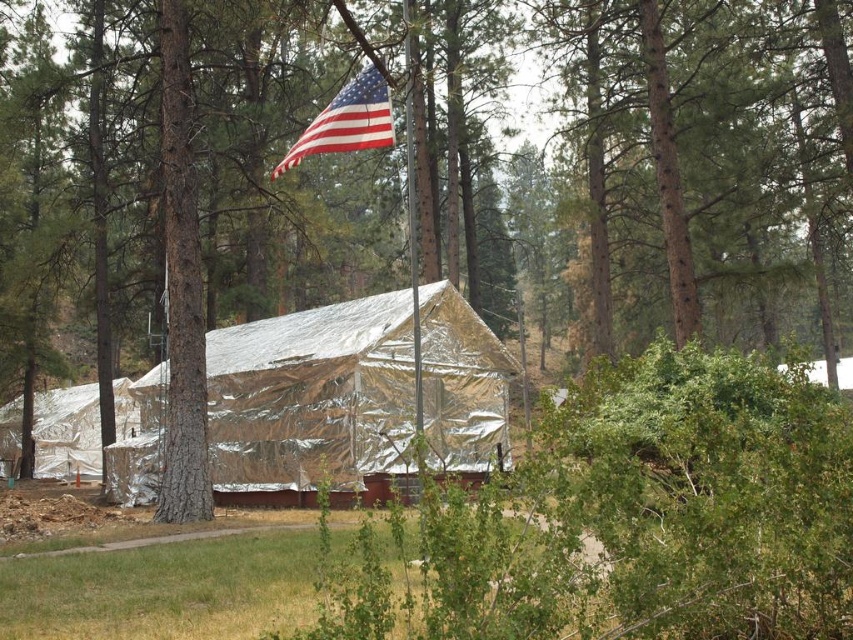
Question: Does silver reflective tarp at lower left appear under american flag at upper center?

Choices:
 (A) no
 (B) yes

Answer: (B)

Question: In this image, where is gold reflective tarp at center located relative to silver reflective tarp at lower left?

Choices:
 (A) below
 (B) above

Answer: (B)

Question: Considering the real-world distances, which object is closest to the silver reflective tarp at lower left?

Choices:
 (A) american flag at upper center
 (B) gold reflective tarp at center

Answer: (B)

Question: Is silver reflective tarp at lower left behind american flag at upper center?

Choices:
 (A) no
 (B) yes

Answer: (B)

Question: Which point is farther to the camera?

Choices:
 (A) (222, 426)
 (B) (341, 148)
 (C) (55, 440)

Answer: (C)

Question: Which point is farther to the camera?

Choices:
 (A) silver reflective tarp at lower left
 (B) gold reflective tarp at center

Answer: (A)